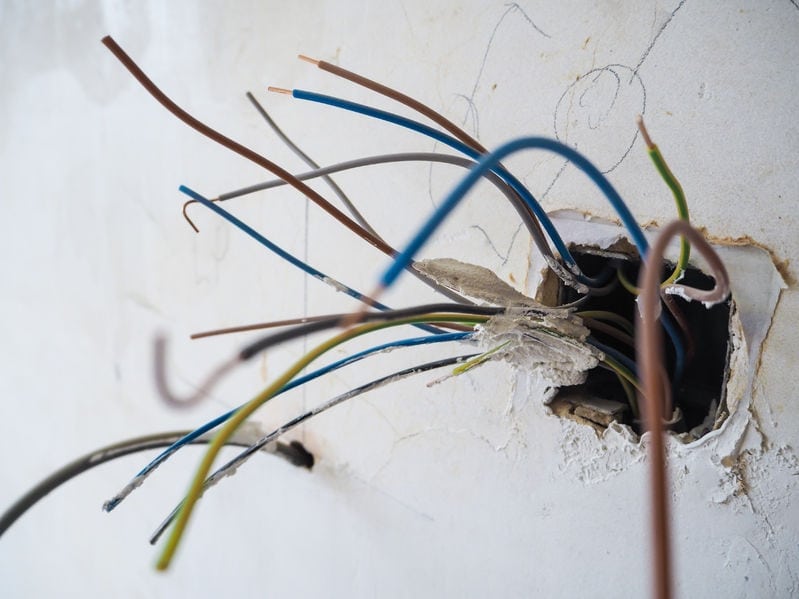
Where is `hole in drywall`? This screenshot has height=599, width=799. hole in drywall is located at coordinates (710, 361).